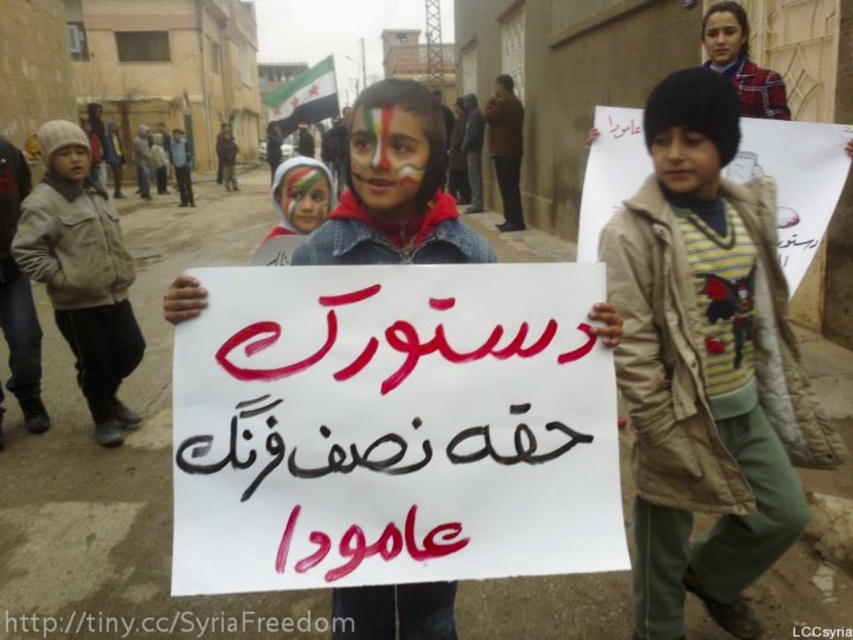
Is blackpapersign at center to the left of matte beige jacket at lower left from the viewer's perspective?

In fact, blackpapersign at center is to the right of matte beige jacket at lower left.

Between point (289, 624) and point (76, 152), which one is positioned in front?

Point (289, 624) is more forward.

What are the coordinates of `blackpapersign at center` in the screenshot? It's located at (164, 624).

Between khaki woolen jacket at center and blackpapersign at center, which one is positioned lower?

blackpapersign at center is lower down.

Does khaki woolen jacket at center appear on the right side of blackpapersign at center?

Correct, you'll find khaki woolen jacket at center to the right of blackpapersign at center.

Image resolution: width=853 pixels, height=640 pixels. What are the coordinates of `khaki woolen jacket at center` in the screenshot? It's located at (706, 376).

Which of these two, multicolored painted face at center or matte beige jacket at lower left, stands shorter?

matte beige jacket at lower left

Is point (366, 168) less distant than point (73, 145)?

Yes, point (366, 168) is in front of point (73, 145).

You are a GUI agent. You are given a task and a screenshot of the screen. Output one action in this format:
    pyautogui.click(x=<x>, y=<y>)
    Task: Click on the multicolored painted face at center
    This screenshot has width=853, height=640.
    Given the screenshot: What is the action you would take?
    pyautogui.click(x=387, y=160)